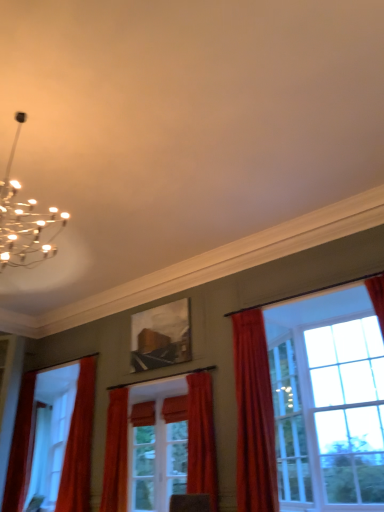
Measure the distance between point (13, 497) and camera.

The distance of point (13, 497) from camera is 5.24 meters.

Measure the distance between point (175, 400) and camera.

They are 4.95 meters apart.

Find the location of a particular element. Image resolution: width=384 pixels, height=512 pixels. clear glass screen door at center is located at coordinates (158, 458).

I want to click on velvet red curtain at right, the first curtain in the right-to-left sequence, so click(254, 416).

Describe the element at coordinates (201, 438) in the screenshot. The height and width of the screenshot is (512, 384). I see `velvet red curtain at center, the second curtain from the right` at that location.

Locate an element on the screen. This screenshot has height=512, width=384. matte wooden picture frame at center is located at coordinates (161, 336).

The image size is (384, 512). In order to click on clear glass window at right in this screenshot , I will do click(254, 415).

Considering the relative positions of matte red curtain at left, the first curtain from the left, and velvet red curtain at right, the first curtain in the right-to-left sequence, in the image provided, is matte red curtain at left, the first curtain from the left, to the left of velvet red curtain at right, the first curtain in the right-to-left sequence, from the viewer's perspective?

Indeed, matte red curtain at left, the first curtain from the left, is positioned on the left side of velvet red curtain at right, the first curtain in the right-to-left sequence.

Is matte red curtain at left, the 5th curtain from the right, in front of or behind velvet red curtain at right, which is counted as the 5th curtain, starting from the left, in the image?

matte red curtain at left, the 5th curtain from the right, is behind velvet red curtain at right, which is counted as the 5th curtain, starting from the left.

Does matte red curtain at left, the 5th curtain from the right, turn towards velvet red curtain at right, the first curtain in the right-to-left sequence?

No, matte red curtain at left, the 5th curtain from the right, is not oriented towards velvet red curtain at right, the first curtain in the right-to-left sequence.

Considering the sizes of objects matte orange curtain at center, which is the 3th curtain from left to right, and velvet red curtain at center, positioned as the 4th curtain in left-to-right order, in the image provided, who is smaller, matte orange curtain at center, which is the 3th curtain from left to right, or velvet red curtain at center, positioned as the 4th curtain in left-to-right order,?

velvet red curtain at center, positioned as the 4th curtain in left-to-right order.

From the matte orange curtain at center, which is the 3th curtain from left to right, count 1st curtains forward and point to it. Please provide its 2D coordinates.

[(201, 438)]

Is point (115, 465) behind point (207, 482)?

Yes, point (115, 465) is behind point (207, 482).

Which of these two, matte orange curtain at center, which is the 3th curtain from left to right, or velvet red curtain at center, positioned as the 4th curtain in left-to-right order, stands taller?

matte orange curtain at center, which is the 3th curtain from left to right.

How different are the orientations of clear glass window at right and orange velvet curtain at left, the second curtain in the left-to-right sequence, in degrees?

The angular difference between clear glass window at right and orange velvet curtain at left, the second curtain in the left-to-right sequence, is 1.21 degrees.

Is clear glass window at right far away from orange velvet curtain at left, the second curtain in the left-to-right sequence?

Yes, clear glass window at right and orange velvet curtain at left, the second curtain in the left-to-right sequence, are quite far apart.

In the image, is clear glass window at right on the left side or the right side of orange velvet curtain at left, the second curtain in the left-to-right sequence?

clear glass window at right is positioned on orange velvet curtain at left, the second curtain in the left-to-right sequence,'s right side.

Considering the sizes of clear glass window at right and orange velvet curtain at left, which is counted as the 4th curtain, starting from the right, in the image, is clear glass window at right bigger or smaller than orange velvet curtain at left, which is counted as the 4th curtain, starting from the right,?

clear glass window at right is bigger than orange velvet curtain at left, which is counted as the 4th curtain, starting from the right.

Visually, is matte red curtain at left, the first curtain from the left, positioned to the left or to the right of velvet red curtain at center, positioned as the 4th curtain in left-to-right order?

matte red curtain at left, the first curtain from the left, is to the left of velvet red curtain at center, positioned as the 4th curtain in left-to-right order.

Does matte red curtain at left, the 5th curtain from the right, touch velvet red curtain at center, positioned as the 4th curtain in left-to-right order?

matte red curtain at left, the 5th curtain from the right, and velvet red curtain at center, positioned as the 4th curtain in left-to-right order, are not in contact.

Between point (28, 456) and point (190, 392), which one is positioned in front?

The point (190, 392) is more forward.

From a real-world perspective, is matte red curtain at left, the 5th curtain from the right, physically located above or below velvet red curtain at center, the second curtain from the right?

From a real-world perspective, matte red curtain at left, the 5th curtain from the right, is physically above velvet red curtain at center, the second curtain from the right.

Based on the photo, which of these two, clear glass screen door at center or matte wooden picture frame at center, is smaller?

With smaller size is clear glass screen door at center.

How different are the orientations of clear glass screen door at center and matte wooden picture frame at center in degrees?

The angular difference between clear glass screen door at center and matte wooden picture frame at center is 0.923 degrees.

Is clear glass screen door at center at the right side of matte wooden picture frame at center?

Indeed, clear glass screen door at center is positioned on the right side of matte wooden picture frame at center.

Which point is more distant from viewer, (182,404) or (179,349)?

The point (179,349) is behind.

From the picture: Is clear glass screen door at center with matte red curtain at left, the 5th curtain from the right?

No.

Is point (134, 439) closer to viewer compared to point (18, 458)?

Yes, point (134, 439) is closer to viewer.

Would you say clear glass screen door at center contains matte red curtain at left, the first curtain from the left?

No.

From a real-world perspective, is clear glass screen door at center on matte red curtain at left, the first curtain from the left?

Actually, clear glass screen door at center is physically below matte red curtain at left, the first curtain from the left, in the real world.

Is clear glass screen door at center looking in the opposite direction of orange velvet curtain at left, which is counted as the 4th curtain, starting from the right?

clear glass screen door at center is not turned away from orange velvet curtain at left, which is counted as the 4th curtain, starting from the right.

Considering the points (178, 490) and (87, 432), which point is in front, point (178, 490) or point (87, 432)?

The point (178, 490) is closer.

Does clear glass screen door at center have a larger size compared to orange velvet curtain at left, which is counted as the 4th curtain, starting from the right?

Incorrect, clear glass screen door at center is not larger than orange velvet curtain at left, which is counted as the 4th curtain, starting from the right.

From the image's perspective, is clear glass screen door at center located above or below orange velvet curtain at left, which is counted as the 4th curtain, starting from the right?

clear glass screen door at center is situated lower than orange velvet curtain at left, which is counted as the 4th curtain, starting from the right, in the image.

From the matte red curtain at left, the 5th curtain from the right, count 4th curtains forward and point to it. Please provide its 2D coordinates.

[(254, 416)]

Identify the location of the 2nd curtain below when counting from the velvet red curtain at center, the second curtain from the right (from the image's perspective). Image resolution: width=384 pixels, height=512 pixels. (116, 454).

Estimate the real-world distances between objects in this image. Which object is closer to orange velvet curtain at left, which is counted as the 4th curtain, starting from the right, matte wooden picture frame at center or clear glass screen door at center?

clear glass screen door at center lies closer to orange velvet curtain at left, which is counted as the 4th curtain, starting from the right, than the other object.

Looking at this image, looking at the image, which one is located closer to velvet red curtain at center, positioned as the 4th curtain in left-to-right order, orange velvet curtain at left, the second curtain in the left-to-right sequence, or matte wooden picture frame at center?

matte wooden picture frame at center is positioned closer to the anchor velvet red curtain at center, positioned as the 4th curtain in left-to-right order.

From the image, which object appears to be nearer to matte orange curtain at center, which is the 3th curtain from left to right, clear glass screen door at center or matte red curtain at left, the first curtain from the left?

clear glass screen door at center.

When comparing their distances from matte wooden picture frame at center, does matte red curtain at left, the first curtain from the left, or velvet red curtain at center, the second curtain from the right, seem further?

matte red curtain at left, the first curtain from the left, lies further to matte wooden picture frame at center than the other object.

Looking at the image, which one is located further to clear glass window at right, clear glass screen door at center or velvet red curtain at right, the first curtain in the right-to-left sequence?

clear glass screen door at center is further to clear glass window at right.

Looking at the image, which one is located closer to orange velvet curtain at left, which is counted as the 4th curtain, starting from the right, velvet red curtain at center, the second curtain from the right, or matte red curtain at left, the first curtain from the left?

Among the two, matte red curtain at left, the first curtain from the left, is located nearer to orange velvet curtain at left, which is counted as the 4th curtain, starting from the right.

When comparing their distances from clear glass window at right, does velvet red curtain at right, the first curtain in the right-to-left sequence, or matte red curtain at left, the first curtain from the left, seem further?

matte red curtain at left, the first curtain from the left.

Which object lies nearer to the anchor point matte orange curtain at center, which is the 3th curtain from left to right, orange velvet curtain at left, which is counted as the 4th curtain, starting from the right, or velvet red curtain at right, the first curtain in the right-to-left sequence?

Among the two, orange velvet curtain at left, which is counted as the 4th curtain, starting from the right, is located nearer to matte orange curtain at center, which is the 3th curtain from left to right.

Find the location of `picture frame between orange velvet curtain at left, the second curtain in the left-to-right sequence, and velvet red curtain at center, the second curtain from the right, from left to right`. picture frame between orange velvet curtain at left, the second curtain in the left-to-right sequence, and velvet red curtain at center, the second curtain from the right, from left to right is located at coordinates (161, 336).

Image resolution: width=384 pixels, height=512 pixels. I want to click on picture frame located between matte red curtain at left, the 5th curtain from the right, and clear glass screen door at center in the left-right direction, so click(x=161, y=336).

Identify the location of screen door situated between matte red curtain at left, the first curtain from the left, and velvet red curtain at right, which is counted as the 5th curtain, starting from the left, from left to right. This screenshot has width=384, height=512. (158, 458).

At what (x,y) coordinates should I click in order to perform the action: click on picture frame between matte red curtain at left, the first curtain from the left, and velvet red curtain at right, which is counted as the 5th curtain, starting from the left, in the horizontal direction. Please return your answer as a coordinate pair (x, y). Looking at the image, I should click on (161, 336).